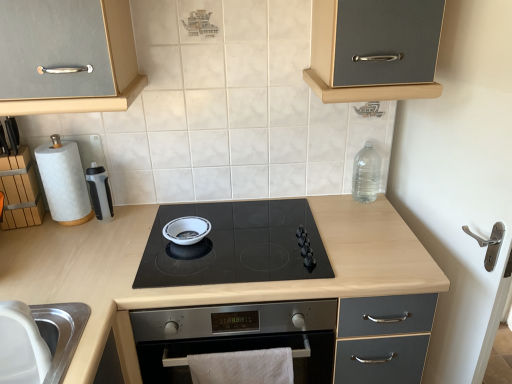
Find the location of a particular element. free space that is to the left of black plastic water bottle at left is located at coordinates (48, 234).